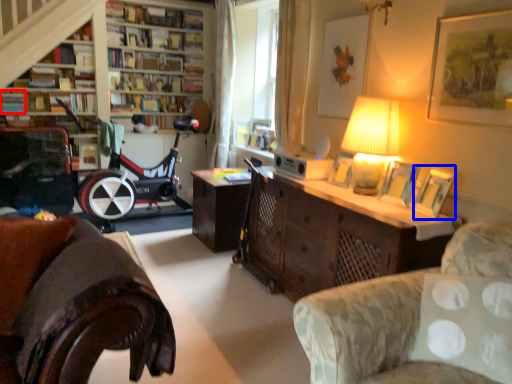
Question: Among these objects, which one is nearest to the camera, book (highlighted by a red box) or picture frame (highlighted by a blue box)?

Choices:
 (A) book
 (B) picture frame

Answer: (B)